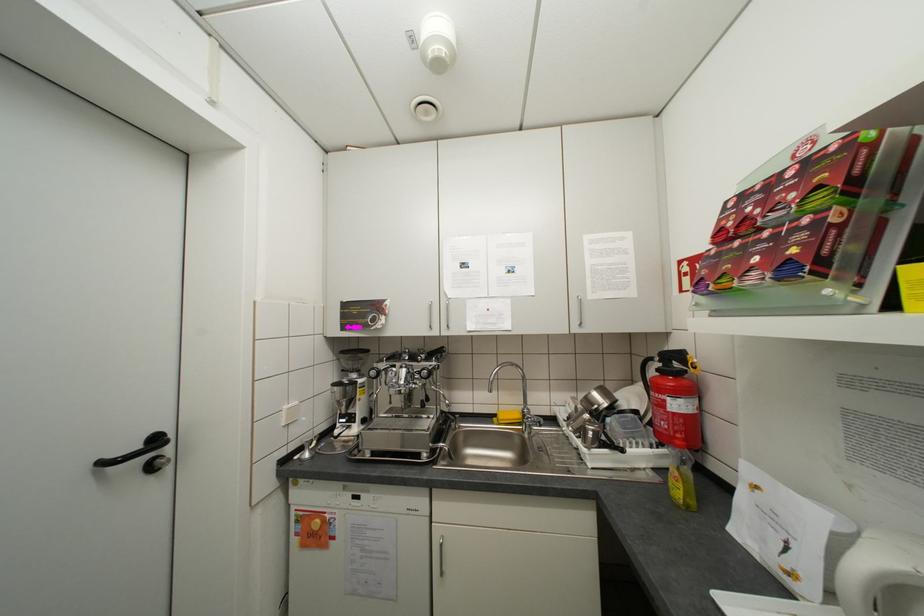
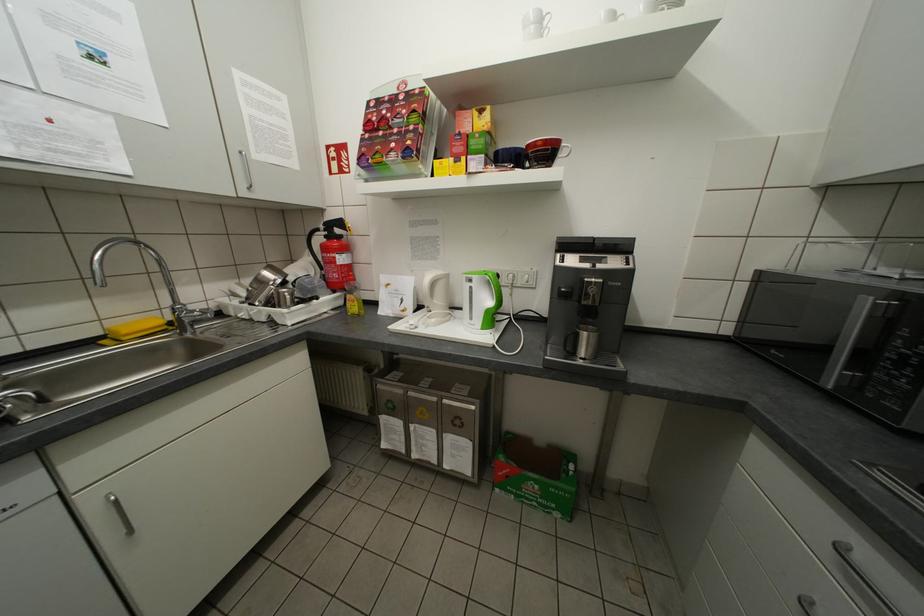
Find the pixel in the second image that matches [679,479] in the first image.

(357, 305)